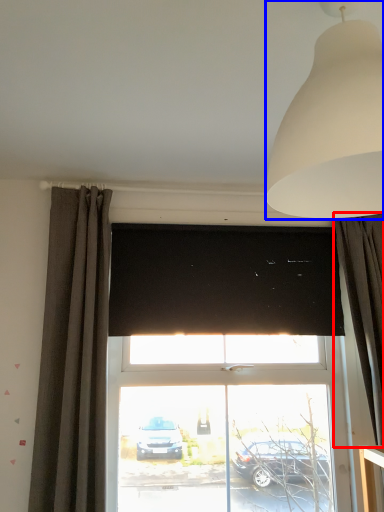
Question: Which object is closer to the camera taking this photo, curtain (highlighted by a red box) or lamp (highlighted by a blue box)?

Choices:
 (A) curtain
 (B) lamp

Answer: (B)